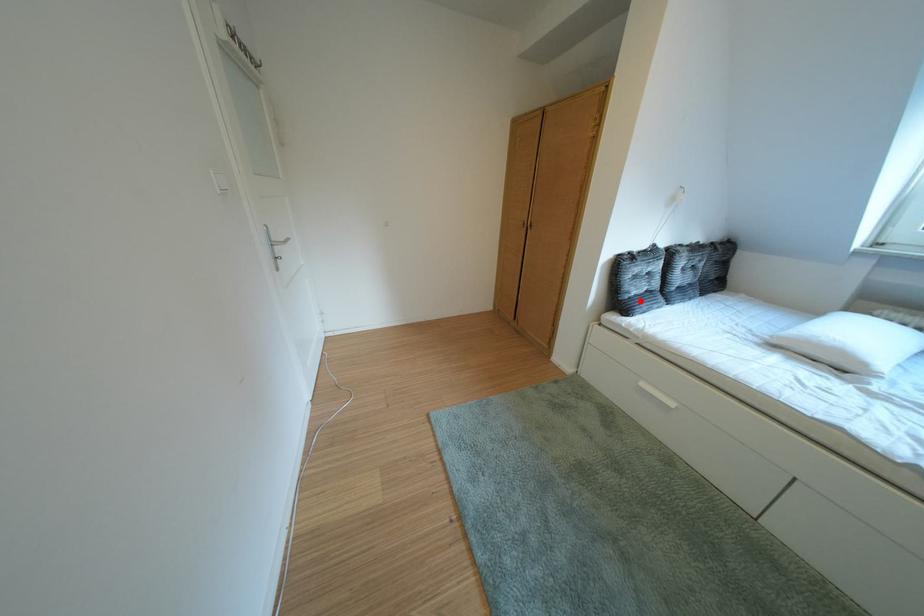
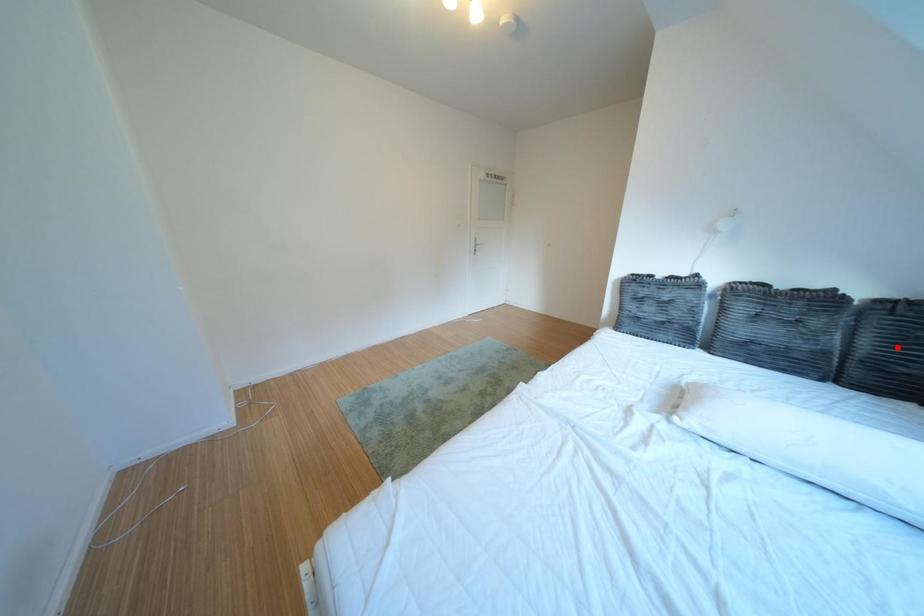
I am providing you with two images of the same scene from different viewpoints. A red point is marked on the first image and another point is marked on the second image. Is the marked point in image1 the same physical position as the marked point in image2?

No